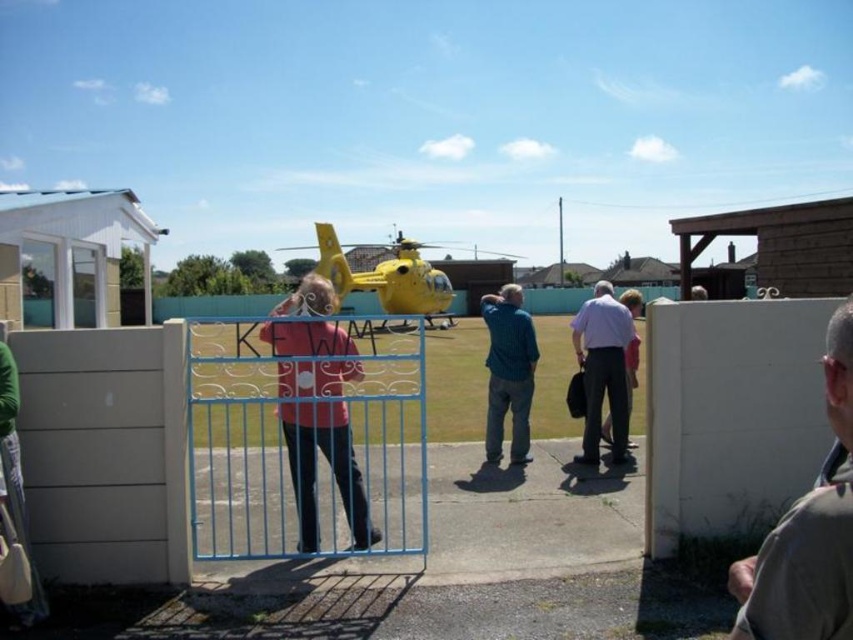
You are standing at the entrance of the scene and want to reach the blue metal gate at center. Which direction should you move to reach it?

The blue metal gate at center is located at point 0.684 on the horizontal axis and 0.347 on the vertical axis. Since you are at the entrance, which is likely at the lower left corner of the scene, you should move towards the right and slightly forward to reach the blue metal gate at center.

You are standing at the entrance of a park and see the blue metal gate at center and the yellow matte helicopter at center. Which object is nearer to you?

The blue metal gate at center is closer to the viewer than the yellow matte helicopter at center.